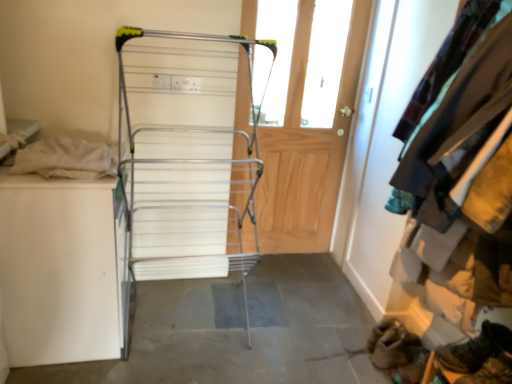
Find the location of a particular element. The width and height of the screenshot is (512, 384). free point above leather boot at lower right (from a real-world perspective) is located at coordinates (490, 331).